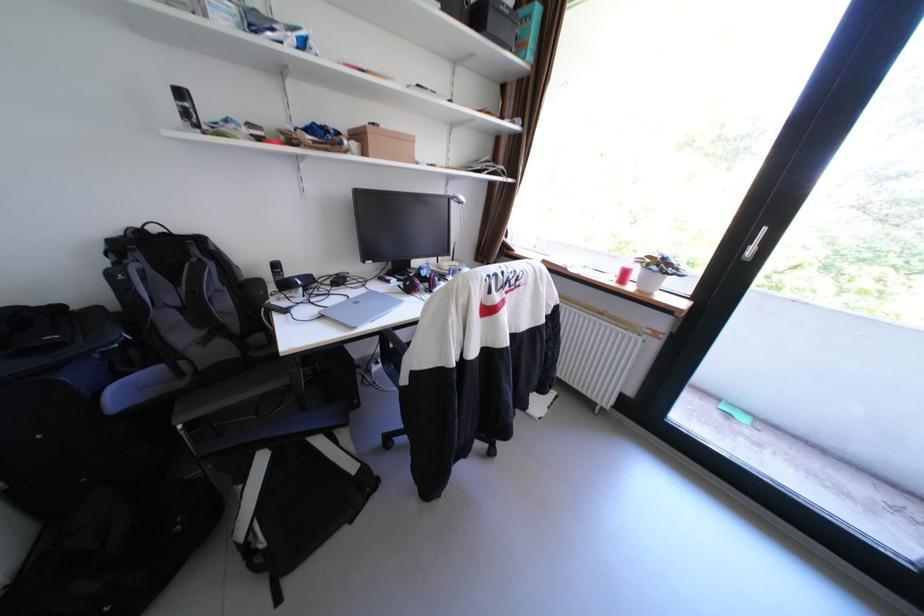
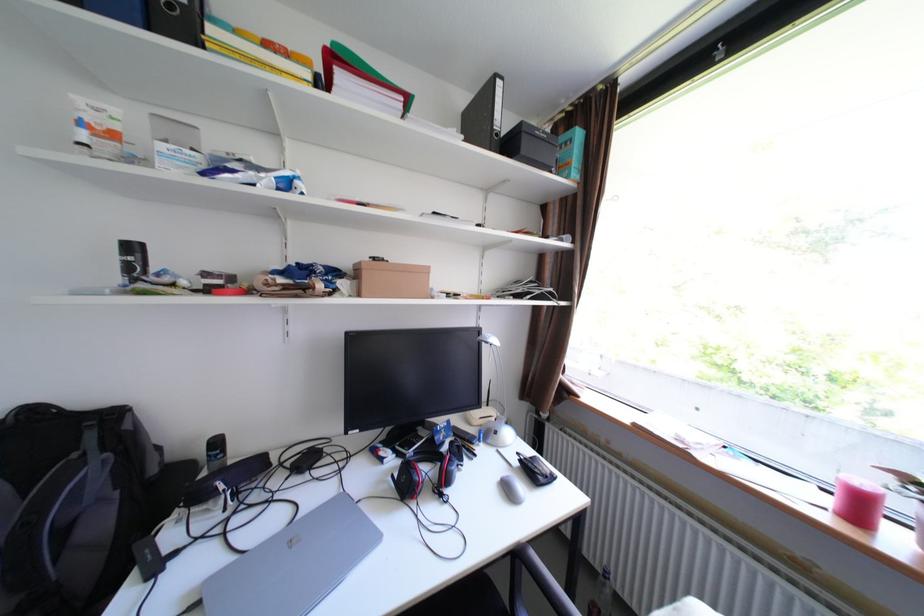
Question: I am providing you with two images of the same scene from different viewpoints. Which of the following objects are not visible in image2?

Choices:
 (A) black computer mouse
 (B) black box
 (C) chair sitting surface
 (D) none of these

Answer: (D)